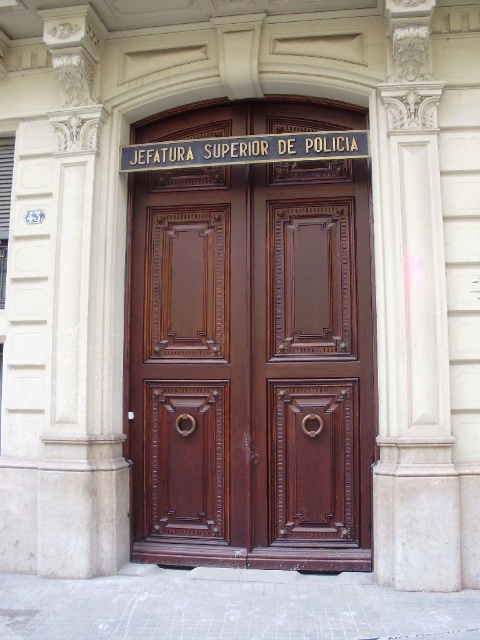
You are standing at the entrance of the police headquarters and need to locate the white marble pillar at upper right. According to the coordinates provided, where exactly is the white marble pillar positioned?

The white marble pillar at upper right is located at point coordinates of 0.502 on the x axis and 0.858 on the y axis.

You are standing in front of the police department entrance and want to know which of the two points, point [276,205] or point [333,148], is closer to you. Based on the door details, can you determine which point is nearer?

Point [276,205] is further to the camera than point [333,148], so the point closer to you is point [333,148].

You are a delivery person standing at the entrance of the JEFATURA SUPERIOR DE POLICIA. You need to deliver a package to the office located at the point marked on the door at coordinates [252,365]. The door has two golden handles on each side. Which handle should you use to open the door towards you?

The point marked at coordinates [252,365] is on the brown polished wood door at center. Since the door is double with two halves divided by a central vertical line, the right golden handle would open the door towards you if the door opens to the right, or the left handle if it opens to the left. However, without knowing the direction the door opens, it is impossible to determine which handle to use.